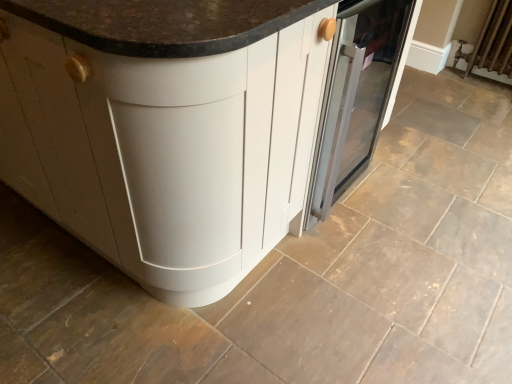
Where is `brown fabric radiator at upper right`? This screenshot has height=384, width=512. brown fabric radiator at upper right is located at coordinates (492, 42).

What is the approximate width of brown fabric radiator at upper right?

14.17 centimeters.

This screenshot has width=512, height=384. What do you see at coordinates (357, 95) in the screenshot? I see `satin silver oven at center` at bounding box center [357, 95].

Where is `white matte cabinet at center`? The image size is (512, 384). white matte cabinet at center is located at coordinates (166, 129).

Is brown fabric radiator at upper right in front of or behind satin silver oven at center in the image?

brown fabric radiator at upper right is behind satin silver oven at center.

Find the location of a particular element. This screenshot has height=384, width=512. radiator on the right of the satin silver oven at center is located at coordinates (492, 42).

From the image's perspective, is brown fabric radiator at upper right located above or below satin silver oven at center?

Clearly, from the image's perspective, brown fabric radiator at upper right is above satin silver oven at center.

Considering the relative sizes of brown fabric radiator at upper right and satin silver oven at center in the image provided, is brown fabric radiator at upper right wider than satin silver oven at center?

No, brown fabric radiator at upper right is not wider than satin silver oven at center.

Consider the image. From a real-world perspective, between satin silver oven at center and white matte cabinet at center, who is vertically higher?

In real-world perspective, white matte cabinet at center is above.

Which of these two, satin silver oven at center or white matte cabinet at center, is bigger?

white matte cabinet at center is bigger.

Considering their positions, is satin silver oven at center located in front of or behind white matte cabinet at center?

satin silver oven at center is behind white matte cabinet at center.

I want to click on radiator on the right of satin silver oven at center, so click(x=492, y=42).

Is satin silver oven at center looking in the opposite direction of brown fabric radiator at upper right?

satin silver oven at center does not have its back to brown fabric radiator at upper right.

Is satin silver oven at center at the left side of brown fabric radiator at upper right?

Correct, you'll find satin silver oven at center to the left of brown fabric radiator at upper right.

Is satin silver oven at center not near brown fabric radiator at upper right?

satin silver oven at center is positioned a significant distance from brown fabric radiator at upper right.

In terms of width, does white matte cabinet at center look wider or thinner when compared to brown fabric radiator at upper right?

Considering their sizes, white matte cabinet at center looks broader than brown fabric radiator at upper right.

Which object is closer to the camera taking this photo, white matte cabinet at center or brown fabric radiator at upper right?

Answer: white matte cabinet at center is more forward.

How distant is white matte cabinet at center from brown fabric radiator at upper right?

white matte cabinet at center is 7.76 feet from brown fabric radiator at upper right.

There is a brown fabric radiator at upper right. Where is `cabinetry above it (from a real-world perspective)`? The height and width of the screenshot is (384, 512). cabinetry above it (from a real-world perspective) is located at coordinates (166, 129).

Is white matte cabinet at center far from satin silver oven at center?

Actually, white matte cabinet at center and satin silver oven at center are a little close together.

Identify the location of cabinetry to the left of satin silver oven at center. (166, 129).

How much distance is there between white matte cabinet at center and satin silver oven at center?

They are 20.43 inches apart.

Can you confirm if brown fabric radiator at upper right is taller than white matte cabinet at center?

Incorrect, the height of brown fabric radiator at upper right is not larger of that of white matte cabinet at center.

Is brown fabric radiator at upper right aimed at white matte cabinet at center?

No, brown fabric radiator at upper right is not aimed at white matte cabinet at center.

Is brown fabric radiator at upper right with white matte cabinet at center?

No, brown fabric radiator at upper right is not making contact with white matte cabinet at center.

Does brown fabric radiator at upper right come behind white matte cabinet at center?

Yes, brown fabric radiator at upper right is further from the viewer.

The height and width of the screenshot is (384, 512). I want to click on home appliance that appears below the brown fabric radiator at upper right (from the image's perspective), so coord(357,95).

In the image, there is a satin silver oven at center. Where is `cabinetry above it (from the image's perspective)`? The height and width of the screenshot is (384, 512). cabinetry above it (from the image's perspective) is located at coordinates (166, 129).

Estimate the real-world distances between objects in this image. Which object is closer to white matte cabinet at center, satin silver oven at center or brown fabric radiator at upper right?

Based on the image, satin silver oven at center appears to be nearer to white matte cabinet at center.

Which object lies further to the anchor point brown fabric radiator at upper right, white matte cabinet at center or satin silver oven at center?

white matte cabinet at center is further to brown fabric radiator at upper right.

Considering their positions, is white matte cabinet at center positioned closer to satin silver oven at center than brown fabric radiator at upper right?

The object closer to satin silver oven at center is white matte cabinet at center.

From the image, which object appears to be farther from satin silver oven at center, brown fabric radiator at upper right or white matte cabinet at center?

brown fabric radiator at upper right.

When comparing their distances from white matte cabinet at center, does brown fabric radiator at upper right or satin silver oven at center seem further?

brown fabric radiator at upper right.

Which object lies nearer to the anchor point brown fabric radiator at upper right, satin silver oven at center or white matte cabinet at center?

satin silver oven at center lies closer to brown fabric radiator at upper right than the other object.

Locate an element on the screen. This screenshot has height=384, width=512. home appliance located between white matte cabinet at center and brown fabric radiator at upper right in the left-right direction is located at coordinates (357, 95).